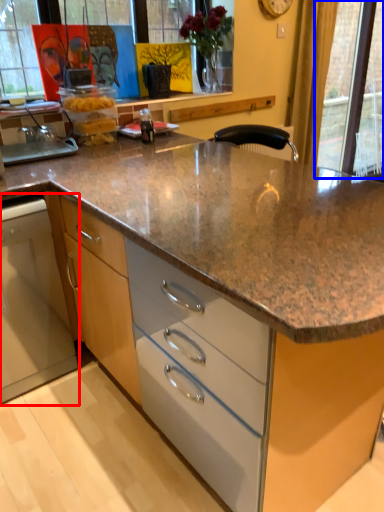
Question: Among these objects, which one is farthest to the camera, home appliance (highlighted by a red box) or glass door (highlighted by a blue box)?

Choices:
 (A) home appliance
 (B) glass door

Answer: (B)